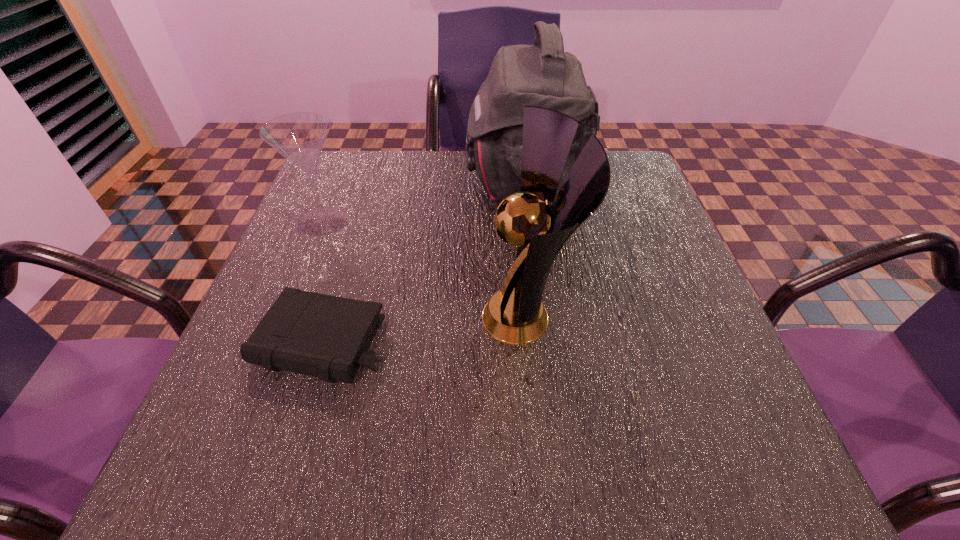
Where is `shoulder bag`? shoulder bag is located at coordinates (543, 75).

The width and height of the screenshot is (960, 540). I want to click on award, so click(515, 315).

Find the location of a particular element. Image resolution: width=960 pixels, height=540 pixels. the third tallest object is located at coordinates (299, 137).

Image resolution: width=960 pixels, height=540 pixels. What are the coordinates of `Bible` in the screenshot? It's located at [x=324, y=336].

Where is `free spot located 0.380m on the open flap of the shoulder bag`? The width and height of the screenshot is (960, 540). free spot located 0.380m on the open flap of the shoulder bag is located at coordinates (317, 184).

This screenshot has width=960, height=540. Find the location of `free space located on the open flap of the shoulder bag`. free space located on the open flap of the shoulder bag is located at coordinates (384, 184).

Identify the location of vacant space located on the open flap of the shoulder bag. (396, 184).

Where is `vacant area situated at the front of the award, where the globe is visible`? Image resolution: width=960 pixels, height=540 pixels. vacant area situated at the front of the award, where the globe is visible is located at coordinates (405, 316).

Find the location of a particular element. Image resolution: width=960 pixels, height=540 pixels. free space located 0.340m at the front of the award, where the globe is visible is located at coordinates (297, 316).

Find the location of a particular element. The image size is (960, 540). blank area located at the front of the award, where the globe is visible is located at coordinates (313, 316).